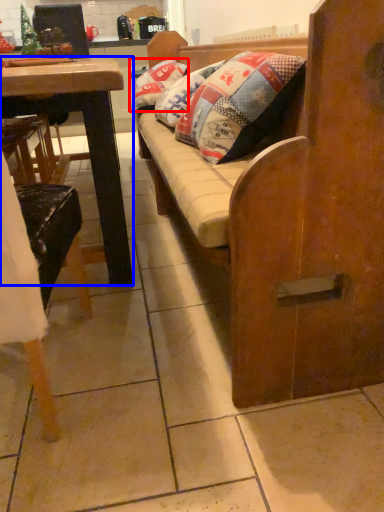
Question: Among these objects, which one is farthest to the camera, pillow (highlighted by a red box) or desk (highlighted by a blue box)?

Choices:
 (A) pillow
 (B) desk

Answer: (A)